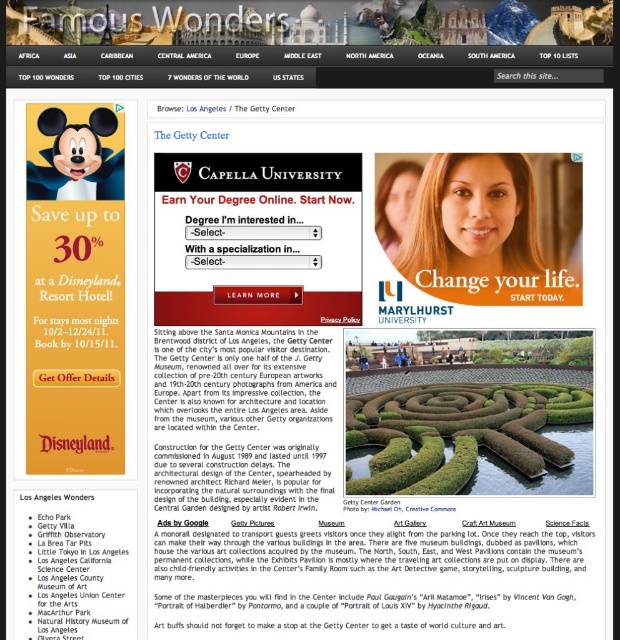
Can you confirm if smooth skin face at center is wider than blonde hair at upper center?

Correct, the width of smooth skin face at center exceeds that of blonde hair at upper center.

Does smooth skin face at center have a greater height compared to blonde hair at upper center?

Yes, smooth skin face at center is taller than blonde hair at upper center.

Who is more distant from viewer, (x=518, y=248) or (x=409, y=189)?

Point (x=518, y=248)

Find the location of a particular element. The height and width of the screenshot is (640, 620). smooth skin face at center is located at coordinates (471, 220).

Can you confirm if smooth skin face at center is thinner than green leafy hedge at center?

Indeed, smooth skin face at center has a lesser width compared to green leafy hedge at center.

Where is `smooth skin face at center`? Image resolution: width=620 pixels, height=640 pixels. smooth skin face at center is located at coordinates (471, 220).

Is green leafy hedge at center to the left of blonde hair at upper center from the viewer's perspective?

In fact, green leafy hedge at center is to the right of blonde hair at upper center.

Find the location of a particular element. This screenshot has height=640, width=620. green leafy hedge at center is located at coordinates (536, 349).

At what (x,y) coordinates should I click in order to perform the action: click on green leafy hedge at center. Please return your answer as a coordinate pair (x, y). This screenshot has height=640, width=620. Looking at the image, I should click on (536, 349).